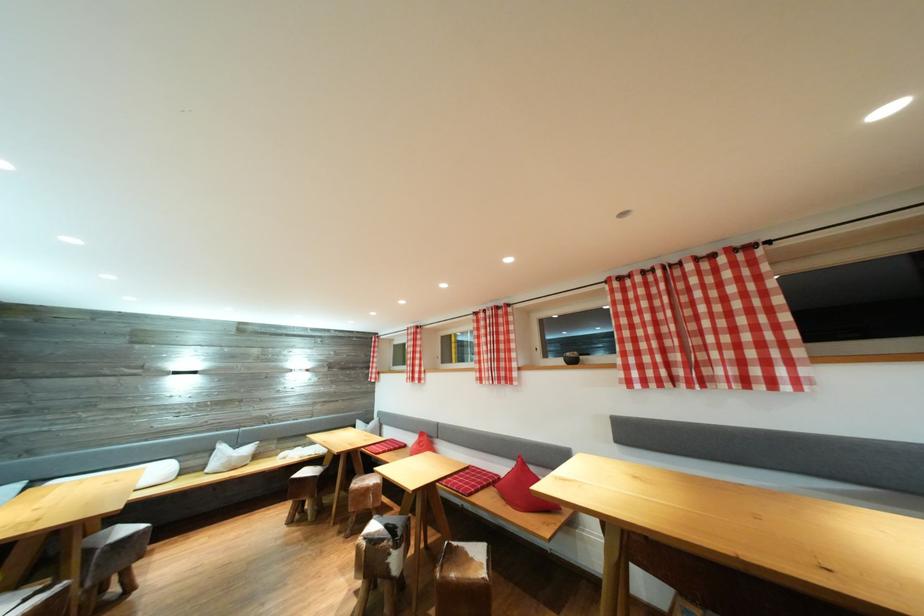
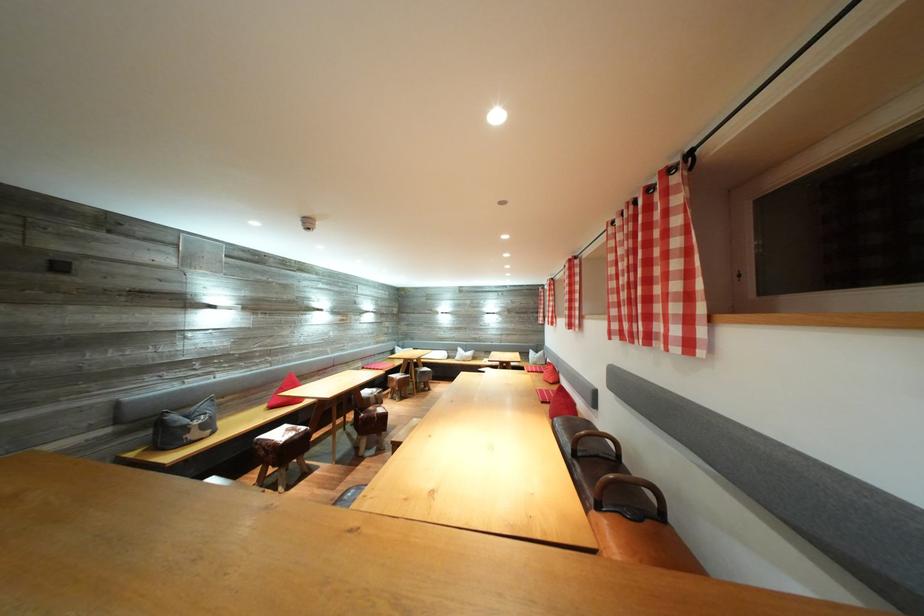
In the second image, find the point that corresponds to the point at 505,374 in the first image.

(578, 322)